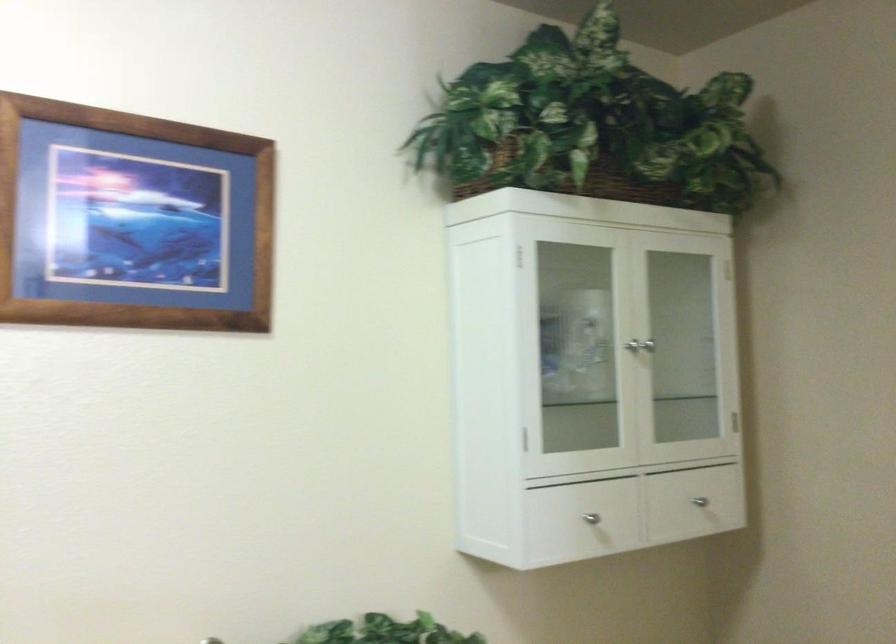
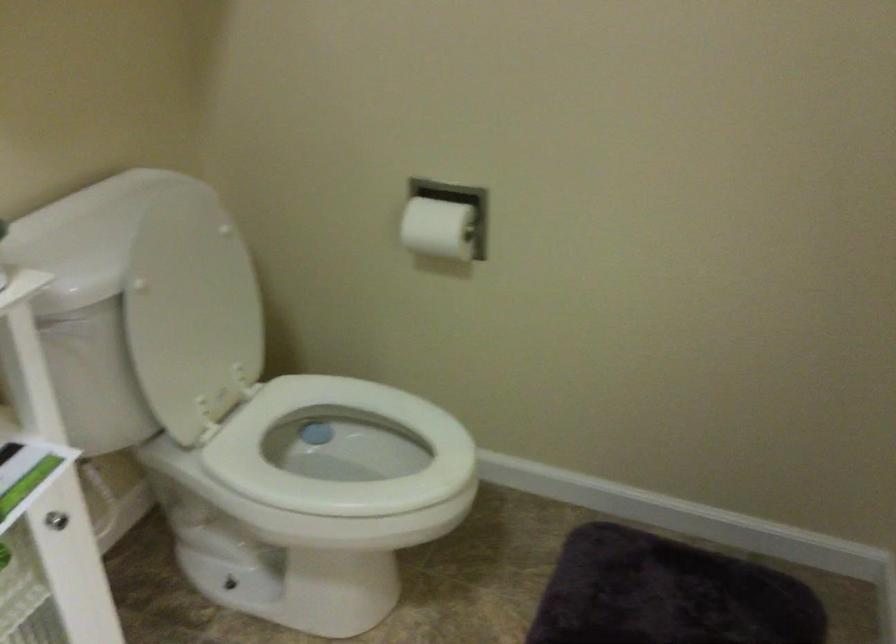
How did the camera likely rotate?

The camera's rotation is toward right-down.